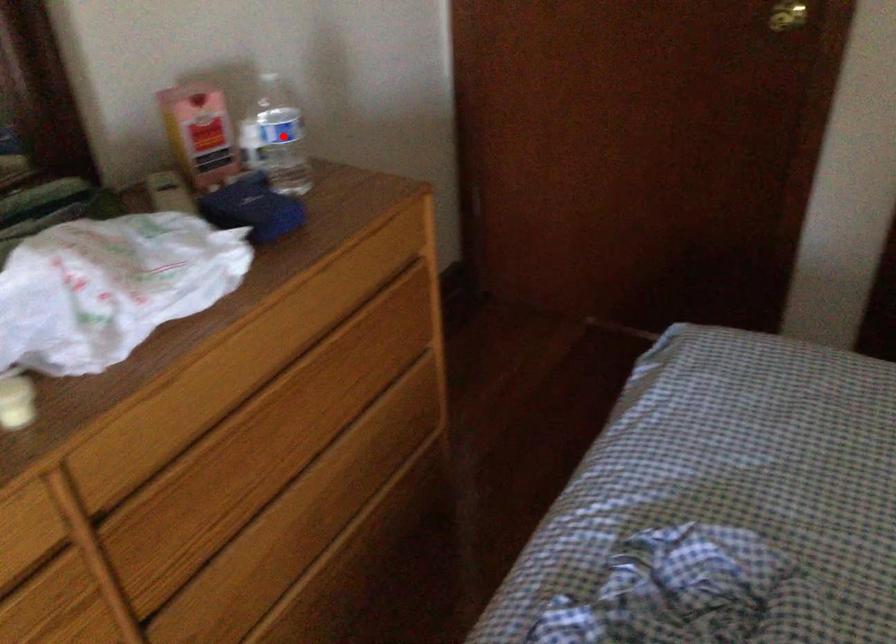
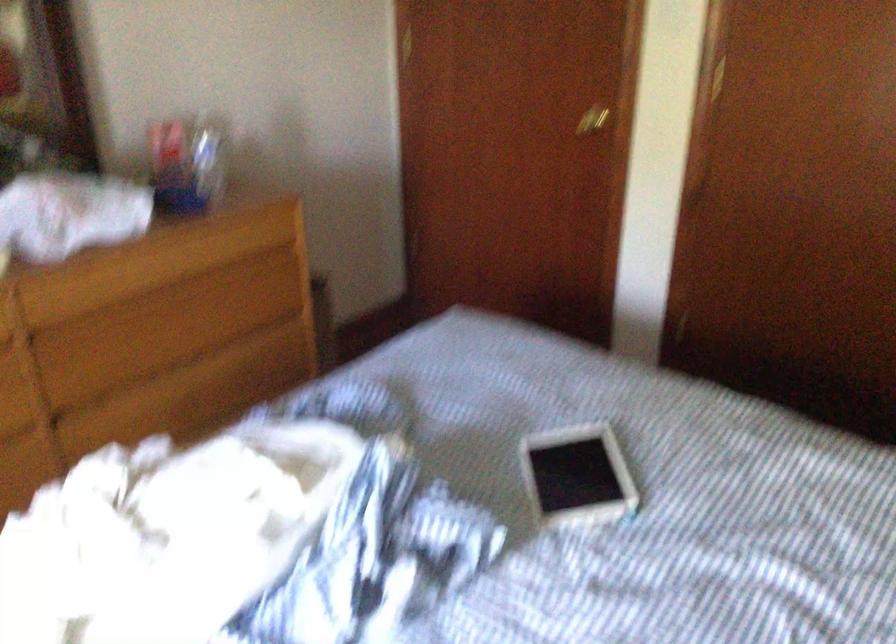
Question: I am providing you with two images of the same scene from different viewpoints. Image1 has a red point marked. In image2, the corresponding 3D location appears at what relative position? Reply with the corresponding letter.

Choices:
 (A) Closer
 (B) Farther

Answer: (B)